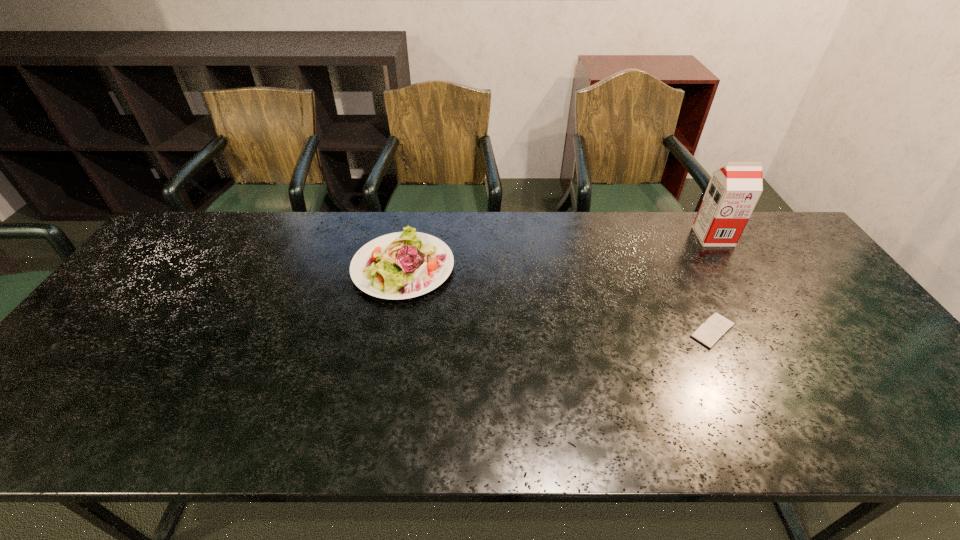
I want to click on the rightmost object, so click(733, 191).

This screenshot has height=540, width=960. Find the location of `the tallest object`. the tallest object is located at coordinates (733, 191).

Identify the location of the second shortest object. (401, 265).

Where is `the leftmost object`? The image size is (960, 540). the leftmost object is located at coordinates (401, 265).

Locate an element on the screen. Image resolution: width=960 pixels, height=540 pixels. the nearest object is located at coordinates (709, 333).

This screenshot has height=540, width=960. I want to click on diary, so click(709, 333).

You are a GUI agent. You are given a task and a screenshot of the screen. Output one action in this format:
    pyautogui.click(x=<x>, y=<y>)
    Task: Click on the vacant space situated 0.260m on the front of the tallest object
    The image size is (960, 540).
    Given the screenshot: What is the action you would take?
    pyautogui.click(x=757, y=307)

What are the coordinates of `free spot located 0.330m on the front of the leftmost object` in the screenshot? It's located at (375, 414).

You are a GUI agent. You are given a task and a screenshot of the screen. Output one action in this format:
    pyautogui.click(x=<x>, y=<y>)
    Task: Click on the vacant area located on the right of the second object from right to left
    The height and width of the screenshot is (540, 960).
    Given the screenshot: What is the action you would take?
    pyautogui.click(x=801, y=330)

The height and width of the screenshot is (540, 960). I want to click on soya milk that is at the far edge, so click(x=733, y=191).